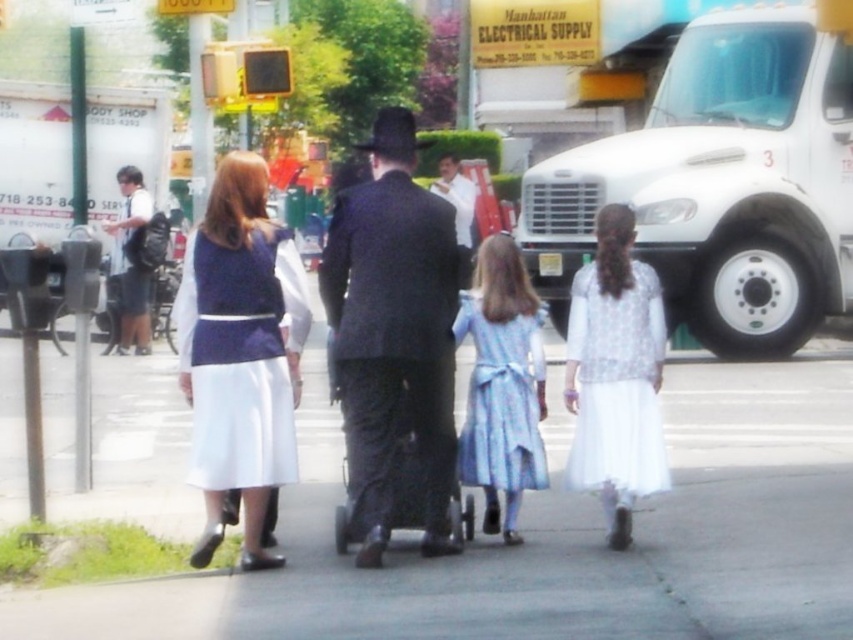
Which is more to the right, gray concrete pavement at center or matte blue dress at center?

gray concrete pavement at center is more to the right.

Is gray concrete pavement at center further to camera compared to matte blue dress at center?

No, gray concrete pavement at center is closer to the viewer.

What do you see at coordinates (555, 536) in the screenshot?
I see `gray concrete pavement at center` at bounding box center [555, 536].

In order to click on gray concrete pavement at center in this screenshot , I will do `click(555, 536)`.

In the scene shown: Can you confirm if white satin dress at center is positioned to the right of white sheer dress at center?

Incorrect, white satin dress at center is not on the right side of white sheer dress at center.

Does point (376, 372) lie in front of point (582, 467)?

Yes, it is.

Between point (399, 211) and point (587, 380), which one is positioned behind?

The point (587, 380) is behind.

Image resolution: width=853 pixels, height=640 pixels. Find the location of `white satin dress at center`. white satin dress at center is located at coordinates (393, 324).

Is gray concrete pavement at center bigger than white shirt and shorts at left?

Yes.

Consider the image. Does gray concrete pavement at center have a greater height compared to white shirt and shorts at left?

Incorrect, gray concrete pavement at center's height is not larger of white shirt and shorts at left's.

The image size is (853, 640). What do you see at coordinates (555, 536) in the screenshot?
I see `gray concrete pavement at center` at bounding box center [555, 536].

Find the location of a particular element. The width and height of the screenshot is (853, 640). gray concrete pavement at center is located at coordinates (555, 536).